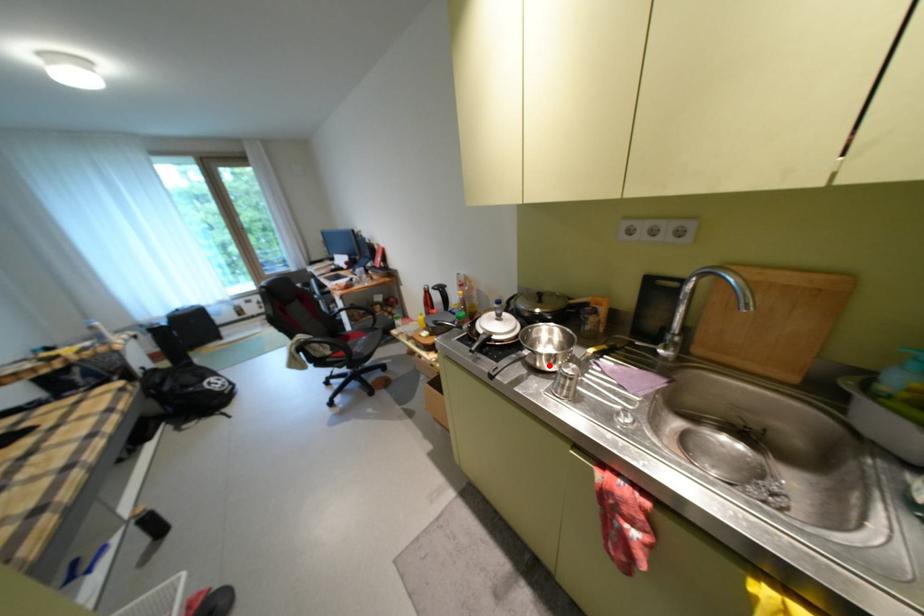
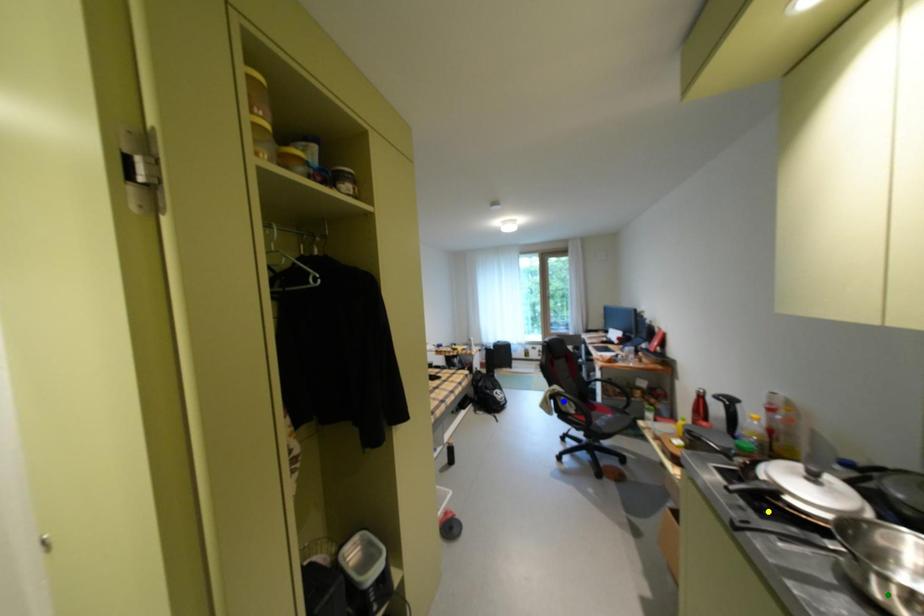
Question: I am providing you with two images of the same scene from different viewpoints. A red point is marked on the first image. You are given multiple points on the second image. Which spot in image 2 lines up with the point in image 1?

Choices:
 (A) blue point
 (B) green point
 (C) yellow point

Answer: (B)